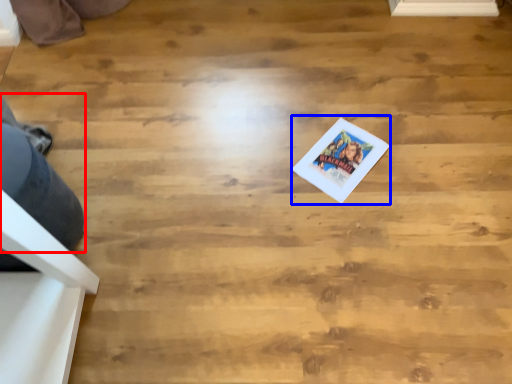
Question: Which object appears farthest to the camera in this image, person (highlighted by a red box) or postcard (highlighted by a blue box)?

Choices:
 (A) person
 (B) postcard

Answer: (B)